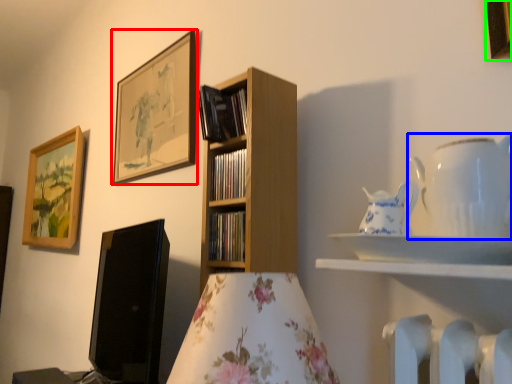
Question: Which object is the closest to the picture frame (highlighted by a red box)? Choose among these: tableware (highlighted by a blue box) or picture frame (highlighted by a green box).

Choices:
 (A) tableware
 (B) picture frame

Answer: (A)